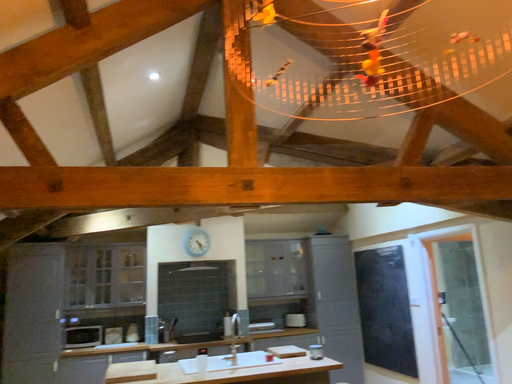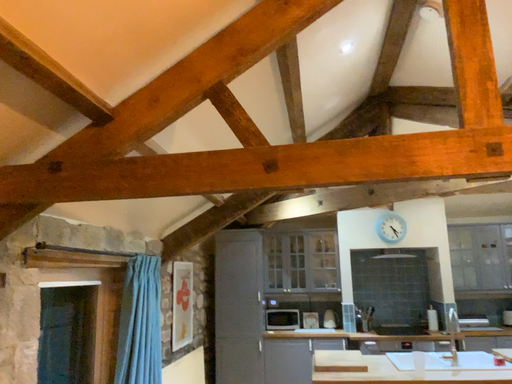
Question: How did the camera likely rotate when shooting the video?

Choices:
 (A) rotated left
 (B) rotated right

Answer: (A)